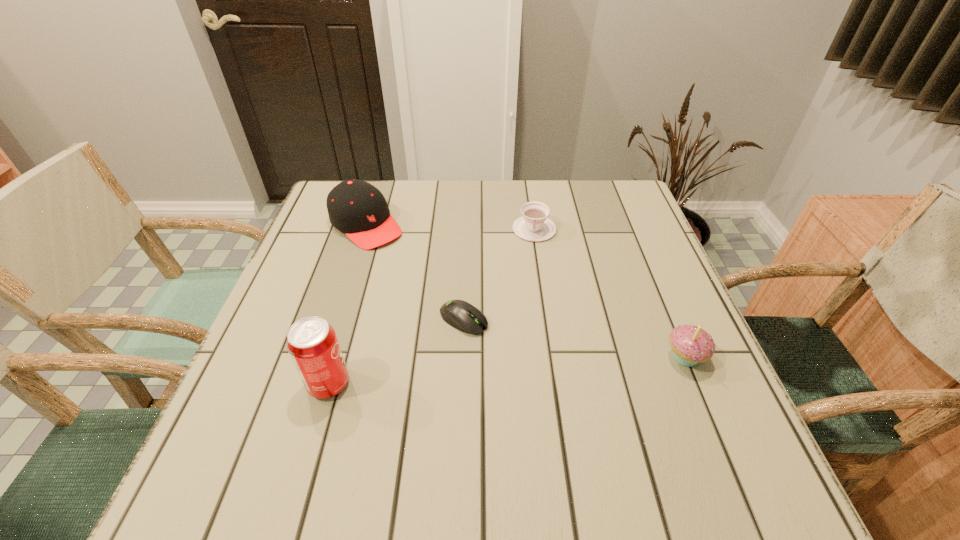
This screenshot has width=960, height=540. Identify the location of empty space that is in between the shortest object and the cap. (415, 272).

Identify which object is the third closest to the cupcake. Please provide its 2D coordinates. Your answer should be formatted as a tuple, i.e. [(x, y)], where the tuple contains the x and y coordinates of a point satisfying the conditions above.

[(312, 343)]

You are a GUI agent. You are given a task and a screenshot of the screen. Output one action in this format:
    pyautogui.click(x=<x>, y=<y>)
    Task: Click on the object that is the third closest to the rightmost object
    The height and width of the screenshot is (540, 960).
    Given the screenshot: What is the action you would take?
    pyautogui.click(x=312, y=343)

Where is `vacant area in the image that satisfies the following two spatial constraints: 1. on the front side of the tallest object; 2. on the left side of the cap`? The width and height of the screenshot is (960, 540). vacant area in the image that satisfies the following two spatial constraints: 1. on the front side of the tallest object; 2. on the left side of the cap is located at coordinates (316, 384).

Where is `vacant area that satisfies the following two spatial constraints: 1. on the front side of the cap; 2. on the left side of the tallest object`? The width and height of the screenshot is (960, 540). vacant area that satisfies the following two spatial constraints: 1. on the front side of the cap; 2. on the left side of the tallest object is located at coordinates pos(316,384).

Where is `free location that satisfies the following two spatial constraints: 1. on the front side of the tallest object; 2. on the left side of the cap`? free location that satisfies the following two spatial constraints: 1. on the front side of the tallest object; 2. on the left side of the cap is located at coordinates (316, 384).